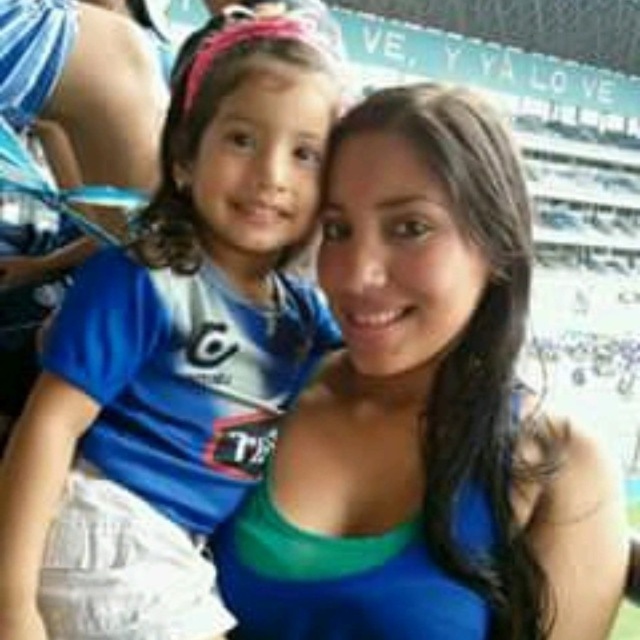
Question: Is blue fabric dress at center smaller than blue jersey at left?

Choices:
 (A) no
 (B) yes

Answer: (B)

Question: Can you confirm if blue fabric dress at center is positioned above blue jersey at left?

Choices:
 (A) no
 (B) yes

Answer: (A)

Question: Does blue fabric dress at center appear over blue jersey at left?

Choices:
 (A) yes
 (B) no

Answer: (B)

Question: Which point is closer to the camera?

Choices:
 (A) blue fabric dress at center
 (B) blue jersey at left

Answer: (B)